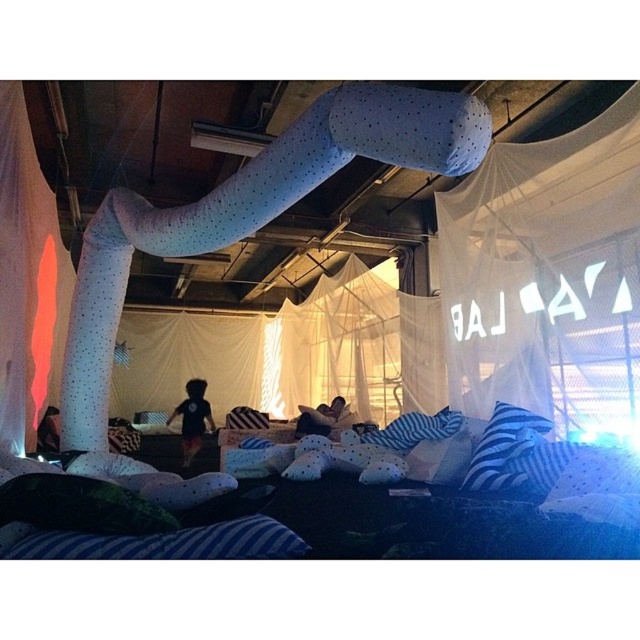
You are a parent trying to set up a play area for your child. You have a toy car that is 2.5 meters long. You want to place it so it can go from the translucent white fabric at left to the blue striped pillow at lower left. Is the space between them long enough for the toy car to travel the full length?

The distance between the translucent white fabric at left and the blue striped pillow at lower left is 3.01 meters. Since the toy car is 2.5 meters long, the space is sufficient as 3.01 meters is greater than 2.5 meters.